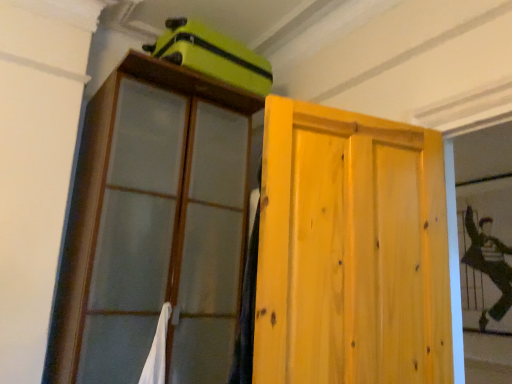
Question: From a real-world perspective, is matte green suitcase at upper center on light wood door at center?

Choices:
 (A) yes
 (B) no

Answer: (A)

Question: Is there a large distance between matte green suitcase at upper center and light wood door at center?

Choices:
 (A) yes
 (B) no

Answer: (A)

Question: Does matte green suitcase at upper center have a smaller size compared to light wood door at center?

Choices:
 (A) yes
 (B) no

Answer: (A)

Question: Considering the relative sizes of matte green suitcase at upper center and light wood door at center in the image provided, is matte green suitcase at upper center shorter than light wood door at center?

Choices:
 (A) yes
 (B) no

Answer: (A)

Question: Considering the relative positions of matte green suitcase at upper center and light wood door at center in the image provided, is matte green suitcase at upper center to the right of light wood door at center from the viewer's perspective?

Choices:
 (A) no
 (B) yes

Answer: (A)

Question: Looking at the image, does silky black fabric at right seem bigger or smaller compared to light wood door at center?

Choices:
 (A) big
 (B) small

Answer: (B)

Question: Considering the positions of point (464, 221) and point (279, 190), is point (464, 221) closer or farther from the camera than point (279, 190)?

Choices:
 (A) farther
 (B) closer

Answer: (A)

Question: Which is correct: silky black fabric at right is inside light wood door at center, or outside of it?

Choices:
 (A) outside
 (B) inside

Answer: (A)

Question: From the image's perspective, relative to light wood door at center, is silky black fabric at right above or below?

Choices:
 (A) below
 (B) above

Answer: (A)

Question: Visually, is light wood door at center positioned to the left or to the right of wooden cabinet at upper left?

Choices:
 (A) left
 (B) right

Answer: (B)

Question: From the image's perspective, is light wood door at center positioned above or below wooden cabinet at upper left?

Choices:
 (A) above
 (B) below

Answer: (A)

Question: Does point (350, 165) appear closer or farther from the camera than point (151, 77)?

Choices:
 (A) farther
 (B) closer

Answer: (B)

Question: Is light wood door at center in front of or behind wooden cabinet at upper left in the image?

Choices:
 (A) behind
 (B) front

Answer: (B)

Question: Does point [290, 155] appear closer or farther from the camera than point [258, 92]?

Choices:
 (A) closer
 (B) farther

Answer: (A)

Question: From a real-world perspective, relative to matte green suitcase at upper center, is light wood door at center vertically above or below?

Choices:
 (A) above
 (B) below

Answer: (B)